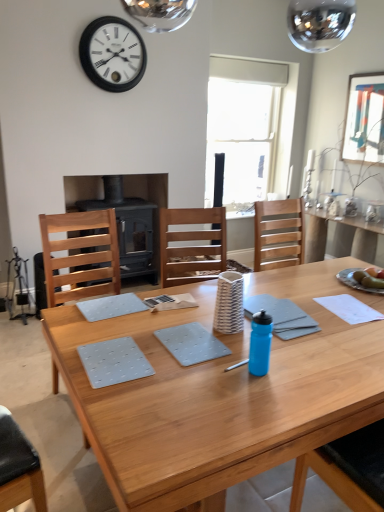
In order to click on vacant area that is in front of green matte apple at center in this screenshot , I will do `click(372, 298)`.